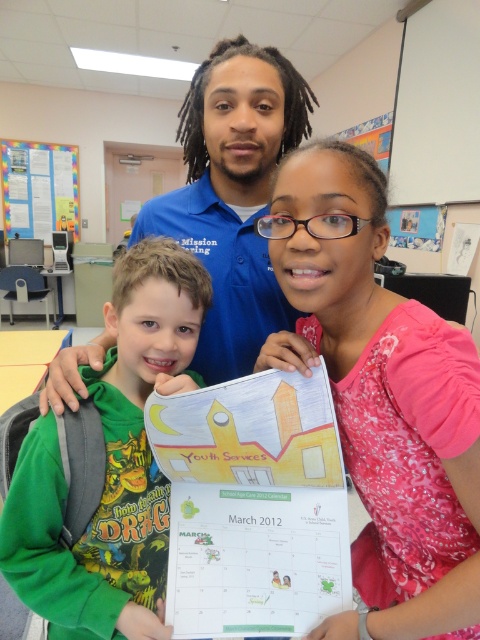
In the image, there is a point marked at coordinates [383,392]. What object is located at this position?

The point at coordinates [383,392] indicates the pink floral dress at center.

Based on the scene description, which object is closer to the observer? The pink floral dress at center or the green cotton shirt at left?

The pink floral dress at center is closer to the observer since it is in front of the green cotton shirt at left.